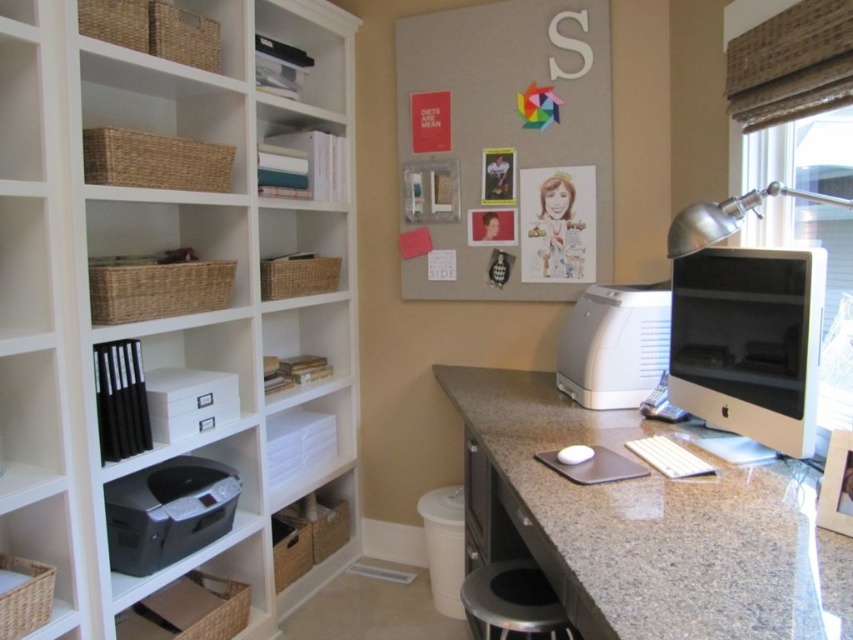
You are setting up a new workspace and need to place a 15 cm tall paperweight. You have the granite desk at lower right and the white glossy computer monitor at right. Which surface can accommodate the paperweight without it being too low to the ground?

The granite desk at lower right is taller than the white glossy computer monitor at right, so placing the paperweight on the granite desk at lower right would provide a suitable height.

You are a person who is 1.7 meters tall and wants to reach the matte gray bulletin board at upper center from the metallic silver stool at lower center. Can you reach it without any assistance?

The matte gray bulletin board at upper center is 1.38 meters away from the metallic silver stool at lower center. Since the distance is less than your height of 1.7 meters, you can reach it without assistance.